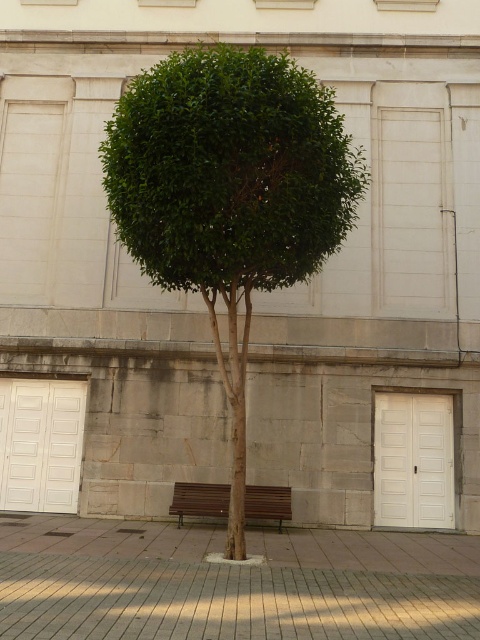
You are standing at the point labeled point (40, 444). What object are you touching?

The point labeled point (40, 444) is on the white glossy door at left, so you are touching the white glossy door at left.

You are standing in front of the building and want to walk from the green leafy tree at center to the white glossy door at left. Which direction should you move to get closer to the door?

Since the green leafy tree at center is closer to the viewer than the white glossy door at left, you should move backward to reach the white glossy door at left.